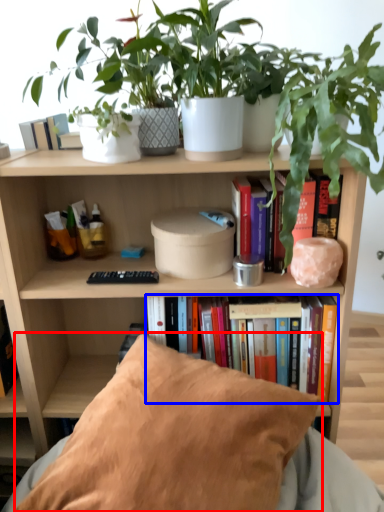
Question: Which object appears closest to the camera in this image, pillow (highlighted by a red box) or book (highlighted by a blue box)?

Choices:
 (A) pillow
 (B) book

Answer: (A)